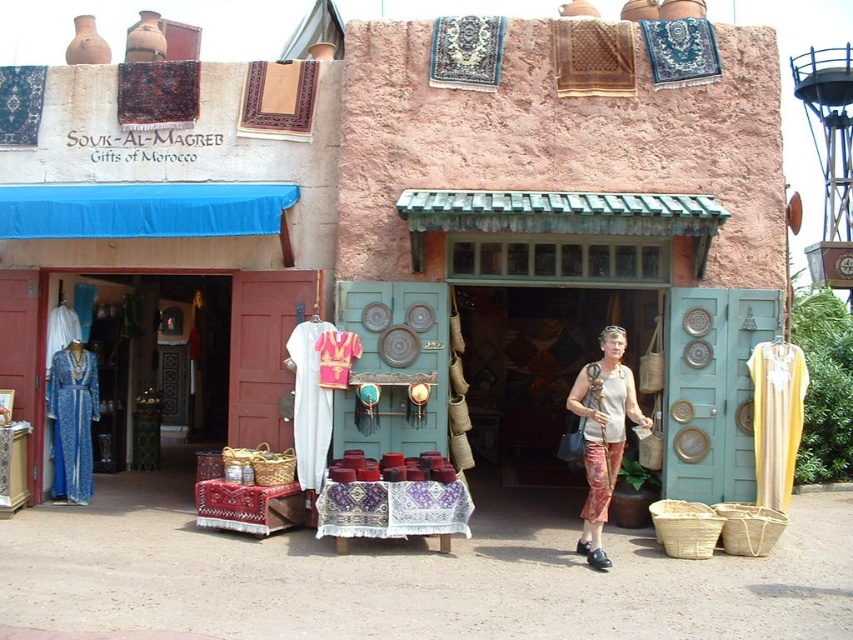
Question: Which point appears closest to the camera in this image?

Choices:
 (A) (88, 376)
 (B) (637, 420)

Answer: (B)

Question: Does matte beige purse at center come in front of blue silk dress at left?

Choices:
 (A) yes
 (B) no

Answer: (A)

Question: Can you confirm if matte beige purse at center is positioned to the left of blue silk dress at left?

Choices:
 (A) no
 (B) yes

Answer: (A)

Question: Is matte beige purse at center thinner than blue silk dress at left?

Choices:
 (A) no
 (B) yes

Answer: (A)

Question: Which of the following is the closest to the observer?

Choices:
 (A) (634, 390)
 (B) (80, 456)

Answer: (A)